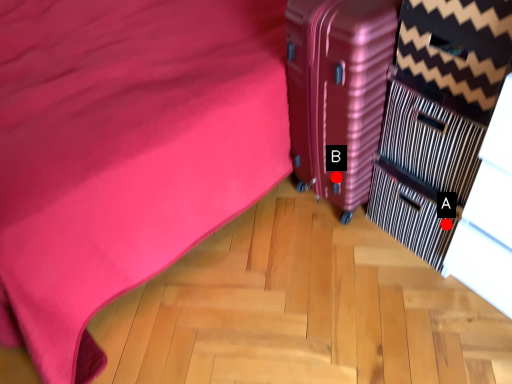
Question: Two points are circled on the image, labeled by A and B beside each circle. Which point appears closest to the camera in this image?

Choices:
 (A) A is closer
 (B) B is closer

Answer: (A)